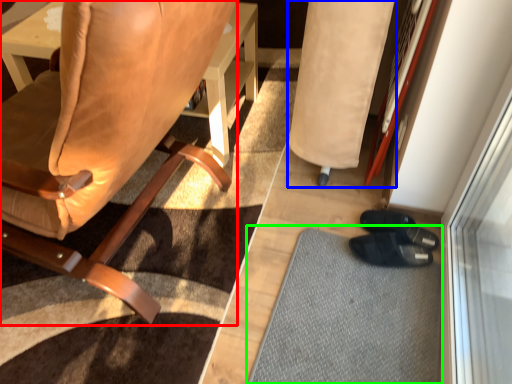
Question: Considering the real-world distances, which object is farthest from chair (highlighted by a red box)? bean bag chair (highlighted by a blue box) or doormat (highlighted by a green box)?

Choices:
 (A) bean bag chair
 (B) doormat

Answer: (B)